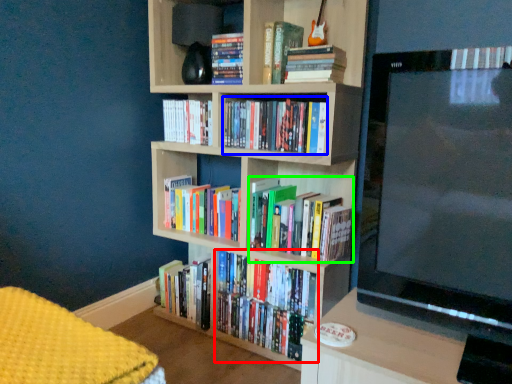
Question: Considering the real-world distances, which object is closest to book (highlighted by a red box)? book (highlighted by a blue box) or book (highlighted by a green box).

Choices:
 (A) book
 (B) book

Answer: (B)